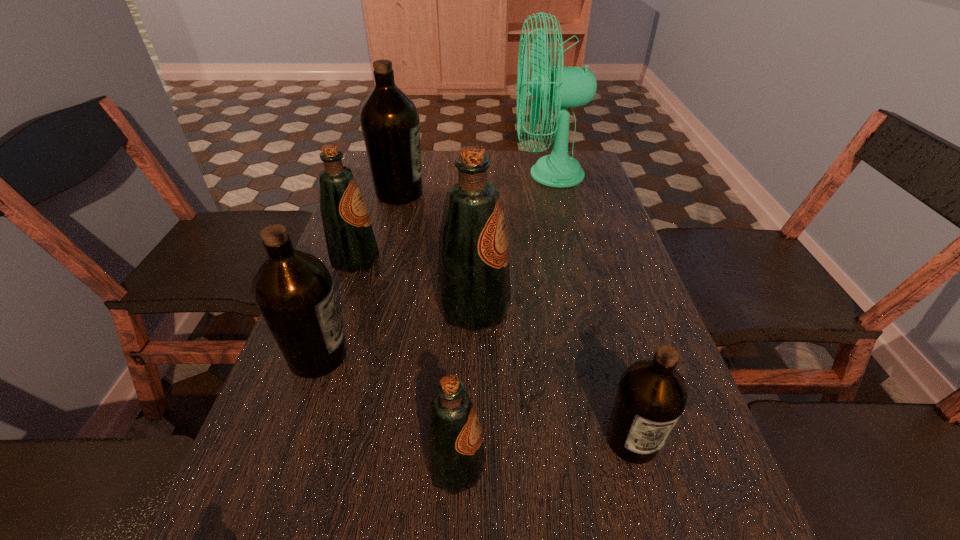
Where is `unoccupied position between the smallest green olive oil and the second farthest brown olive oil`? This screenshot has width=960, height=540. unoccupied position between the smallest green olive oil and the second farthest brown olive oil is located at coordinates (387, 411).

Identify the location of free space between the farthest brown olive oil and the second smallest brown olive oil. (359, 274).

What are the coordinates of `empty space that is in between the blue fan and the nearest brown olive oil` in the screenshot? It's located at (590, 308).

Identify the location of free spot between the rightmost brown olive oil and the biggest green olive oil. (553, 375).

Identify the location of object that is the closest to the fifth nearest olive oil. This screenshot has height=540, width=960. (474, 293).

The width and height of the screenshot is (960, 540). What are the coordinates of `the third closest object to the second farthest brown olive oil` in the screenshot? It's located at (454, 452).

I want to click on olive oil that is the fifth closest to the fifth nearest object, so click(652, 395).

Where is `olive oil identified as the fifth closest to the nearest green olive oil`? olive oil identified as the fifth closest to the nearest green olive oil is located at coordinates (389, 120).

The height and width of the screenshot is (540, 960). Identify the location of green olive oil object that ranks as the closest to the blue fan. (474, 293).

Point out which green olive oil is positioned as the second nearest to the smallest green olive oil. Please provide its 2D coordinates. Your answer should be formatted as a tuple, i.e. [(x, y)], where the tuple contains the x and y coordinates of a point satisfying the conditions above.

[(350, 241)]